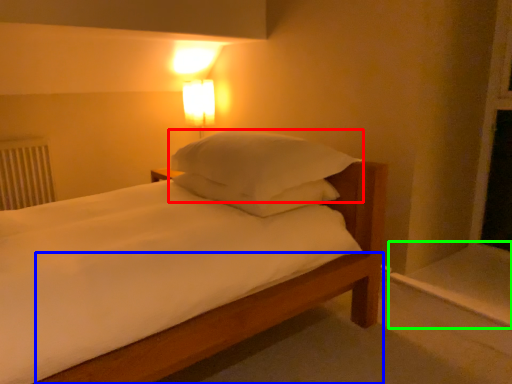
Question: Which object is positioned farthest from pillow (highlighted by a red box)? Select from bed frame (highlighted by a blue box) and window sill (highlighted by a green box).

Choices:
 (A) bed frame
 (B) window sill

Answer: (B)